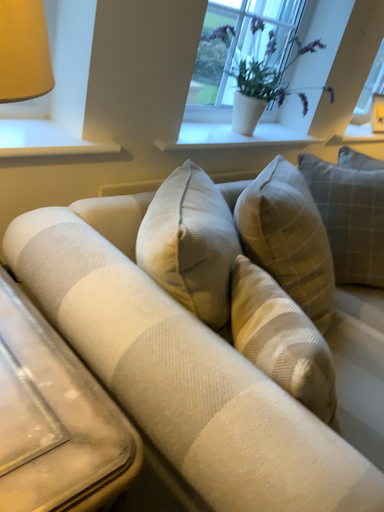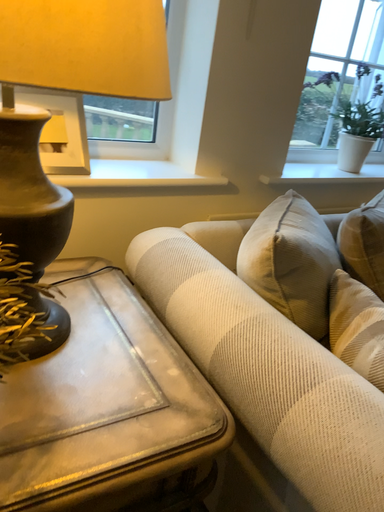
Question: Which way did the camera rotate in the video?

Choices:
 (A) rotated left
 (B) rotated right

Answer: (A)